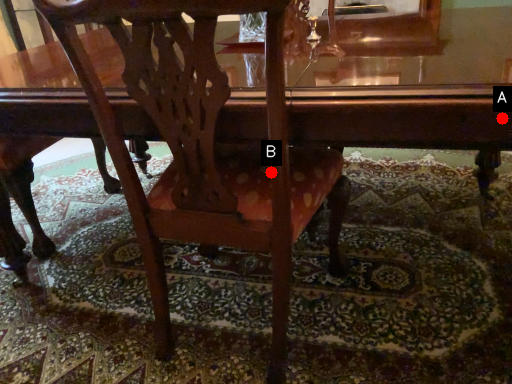
Question: Two points are circled on the image, labeled by A and B beside each circle. Among these points, which one is nearest to the camera?

Choices:
 (A) A is closer
 (B) B is closer

Answer: (A)